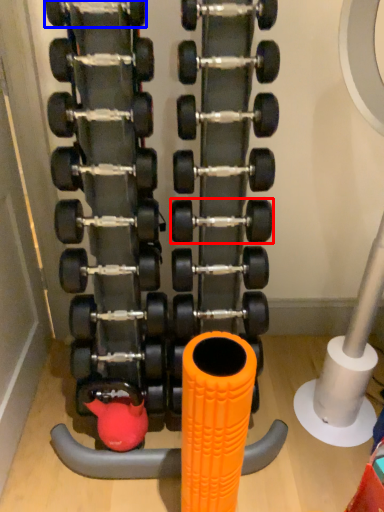
Question: Among these objects, which one is farthest to the camera, dumbbell (highlighted by a red box) or dumbbell (highlighted by a blue box)?

Choices:
 (A) dumbbell
 (B) dumbbell

Answer: (A)